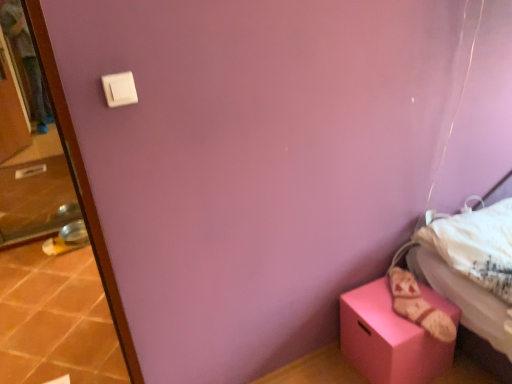
Question: Is matte pink box at lower right positioned beyond the bounds of terracotta tile at lower left?

Choices:
 (A) no
 (B) yes

Answer: (B)

Question: Is matte pink box at lower right oriented away from terracotta tile at lower left?

Choices:
 (A) no
 (B) yes

Answer: (A)

Question: From a real-world perspective, is matte pink box at lower right positioned over terracotta tile at lower left based on gravity?

Choices:
 (A) no
 (B) yes

Answer: (B)

Question: Is matte pink box at lower right behind terracotta tile at lower left?

Choices:
 (A) yes
 (B) no

Answer: (B)

Question: Considering the relative positions of matte pink box at lower right and terracotta tile at lower left in the image provided, is matte pink box at lower right to the right of terracotta tile at lower left from the viewer's perspective?

Choices:
 (A) no
 (B) yes

Answer: (B)

Question: Considering the relative sizes of matte pink box at lower right and terracotta tile at lower left in the image provided, is matte pink box at lower right taller than terracotta tile at lower left?

Choices:
 (A) no
 (B) yes

Answer: (B)

Question: From a real-world perspective, is white plastic light switch at upper left physically below matte pink box at lower right?

Choices:
 (A) yes
 (B) no

Answer: (B)

Question: Considering the relative sizes of white plastic light switch at upper left and matte pink box at lower right in the image provided, is white plastic light switch at upper left shorter than matte pink box at lower right?

Choices:
 (A) no
 (B) yes

Answer: (B)

Question: Is white plastic light switch at upper left to the right of matte pink box at lower right from the viewer's perspective?

Choices:
 (A) yes
 (B) no

Answer: (B)

Question: Is white plastic light switch at upper left located outside matte pink box at lower right?

Choices:
 (A) yes
 (B) no

Answer: (A)

Question: Does white plastic light switch at upper left contain matte pink box at lower right?

Choices:
 (A) no
 (B) yes

Answer: (A)

Question: Is the position of white plastic light switch at upper left more distant than that of matte pink box at lower right?

Choices:
 (A) no
 (B) yes

Answer: (A)

Question: Would you say terracotta tile at lower left is part of white plastic light switch at upper left's contents?

Choices:
 (A) no
 (B) yes

Answer: (A)